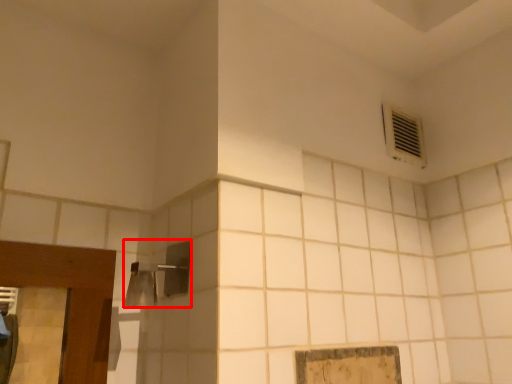
Question: Considering the relative positions of shower (annotated by the red box) and air conditioning in the image provided, where is shower (annotated by the red box) located with respect to the staircase?

Choices:
 (A) left
 (B) right

Answer: (A)